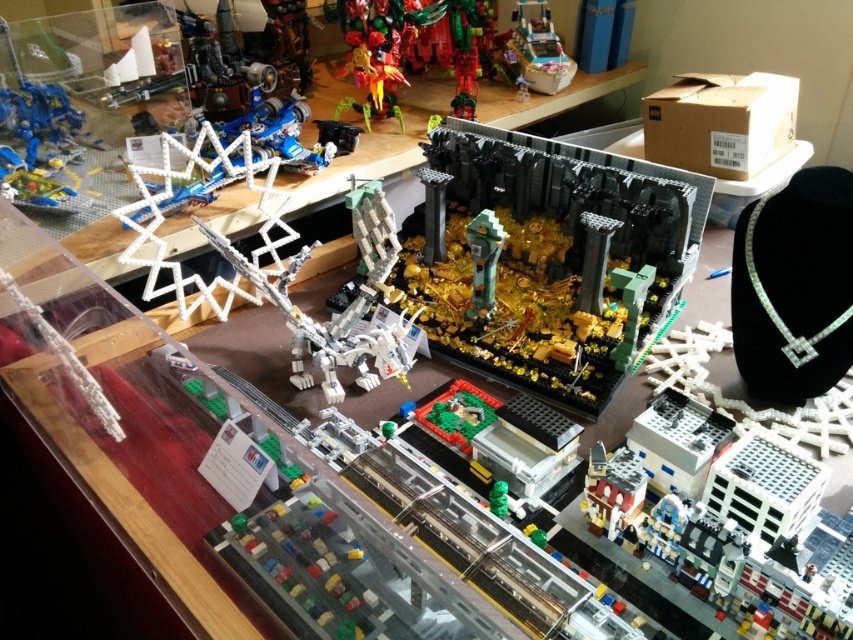
You are a visitor at a LEGO exhibition and see the dark gray stone structure at center and the metallic silver car at upper right. Which object is positioned higher in the image?

The metallic silver car at upper right is positioned higher in the image than the dark gray stone structure at center.

You are a visitor at a LEGO exhibition and want to take a photo of both the dark gray stone structure at center and the metallic silver car at upper right. Can you see both objects clearly in the same photo without moving your camera?

Yes, because the dark gray stone structure at center is in front of the metallic silver car at upper right, so both can be captured in the same photo as long as the camera is positioned to include both in the frame.

You are a toy store employee who needs to move the metallic silver car at upper right closer to the dark gray stone structure at center for a display. How much distance do you need to cover to place them together?

The dark gray stone structure at center and metallic silver car at upper right are 3.51 feet apart from each other, so you need to move the metallic silver car at upper right 3.51 feet closer to the dark gray stone structure at center.